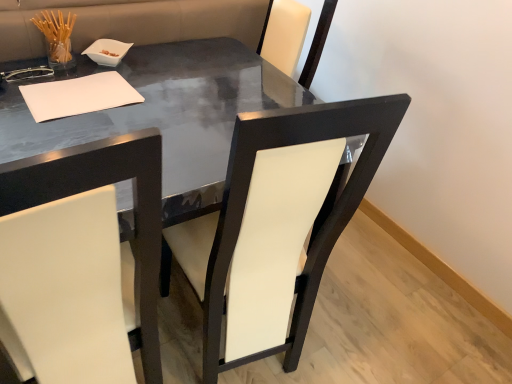
Question: From a real-world perspective, is white leather chair at center, which is counted as the 1th chair, starting from the right, beneath glossy black table at center?

Choices:
 (A) yes
 (B) no

Answer: (B)

Question: Is white leather chair at center, arranged as the 2th chair when viewed from the left, further to the viewer compared to glossy black table at center?

Choices:
 (A) no
 (B) yes

Answer: (A)

Question: Is glossy black table at center at the back of white leather chair at center, which is counted as the 1th chair, starting from the right?

Choices:
 (A) no
 (B) yes

Answer: (B)

Question: Does white leather chair at center, which is counted as the 1th chair, starting from the right, appear on the right side of glossy black table at center?

Choices:
 (A) yes
 (B) no

Answer: (A)

Question: From the image's perspective, is white leather chair at center, which is counted as the 1th chair, starting from the right, beneath glossy black table at center?

Choices:
 (A) yes
 (B) no

Answer: (A)

Question: Considering the relative sizes of white leather chair at center, which is counted as the 1th chair, starting from the right, and glossy black table at center in the image provided, is white leather chair at center, which is counted as the 1th chair, starting from the right, taller than glossy black table at center?

Choices:
 (A) yes
 (B) no

Answer: (A)

Question: From the image's perspective, is white paper at upper left beneath white leather chair at left, positioned as the second chair in right-to-left order?

Choices:
 (A) no
 (B) yes

Answer: (A)

Question: Is white leather chair at left, positioned as the second chair in right-to-left order, a part of white paper at upper left?

Choices:
 (A) no
 (B) yes

Answer: (A)

Question: From a real-world perspective, is white paper at upper left over white leather chair at left, which is the first chair in left-to-right order?

Choices:
 (A) no
 (B) yes

Answer: (B)

Question: Would you consider white paper at upper left to be distant from white leather chair at left, which is the first chair in left-to-right order?

Choices:
 (A) yes
 (B) no

Answer: (B)

Question: Is the position of white paper at upper left more distant than that of white leather chair at left, which is the first chair in left-to-right order?

Choices:
 (A) no
 (B) yes

Answer: (B)

Question: Is the depth of white paper at upper left less than that of white leather chair at left, positioned as the second chair in right-to-left order?

Choices:
 (A) no
 (B) yes

Answer: (A)

Question: Can you confirm if glossy black table at center is smaller than white leather chair at left, which is the first chair in left-to-right order?

Choices:
 (A) no
 (B) yes

Answer: (A)